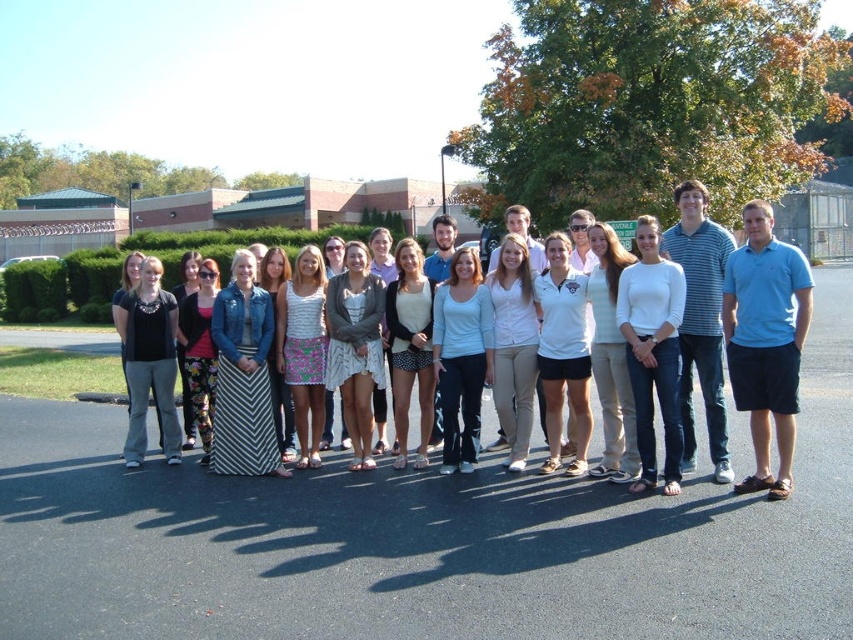
Image resolution: width=853 pixels, height=640 pixels. I want to click on black asphalt at center, so click(422, 540).

Can you confirm if black asphalt at center is smaller than white cotton dress at center?

Correct, black asphalt at center occupies less space than white cotton dress at center.

Measure the distance between point (184, 554) and camera.

Point (184, 554) and camera are 5.48 meters apart from each other.

I want to click on black asphalt at center, so click(422, 540).

Is white cotton dress at center above blue cotton polo shirt at right?

Yes, white cotton dress at center is above blue cotton polo shirt at right.

Does point (757, 445) lie behind point (730, 378)?

That is False.

Identify the location of white cotton dress at center. The height and width of the screenshot is (640, 853). (737, 323).

Which of these two, black asphalt at center or blue cotton polo shirt at right, stands taller?

blue cotton polo shirt at right is taller.

Is black asphalt at center thinner than blue cotton polo shirt at right?

Incorrect, black asphalt at center's width is not less than blue cotton polo shirt at right's.

Who is more forward, (33, 438) or (753, 451)?

Point (753, 451) is more forward.

You are a GUI agent. You are given a task and a screenshot of the screen. Output one action in this format:
    pyautogui.click(x=<x>, y=<y>)
    Task: Click on the black asphalt at center
    
    Given the screenshot: What is the action you would take?
    pyautogui.click(x=422, y=540)